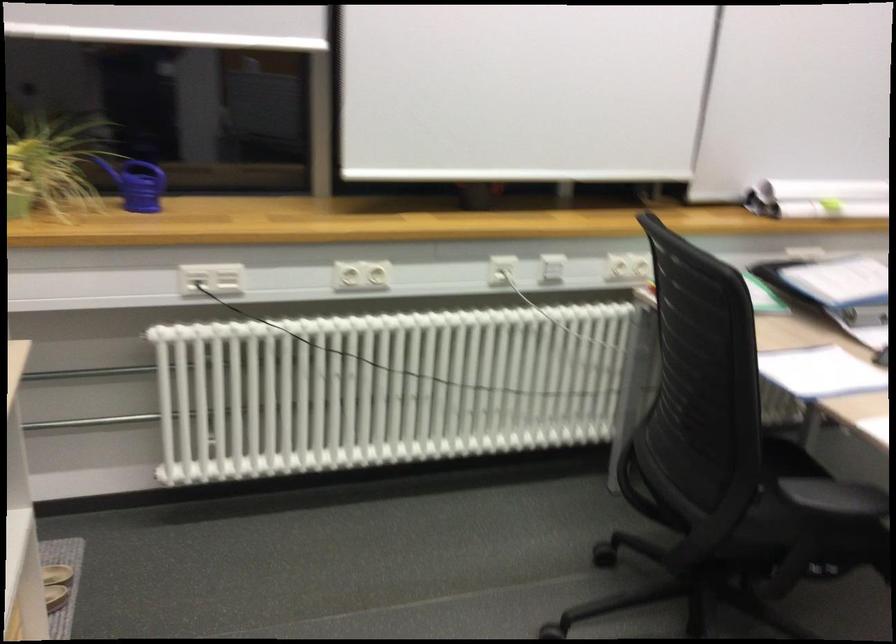
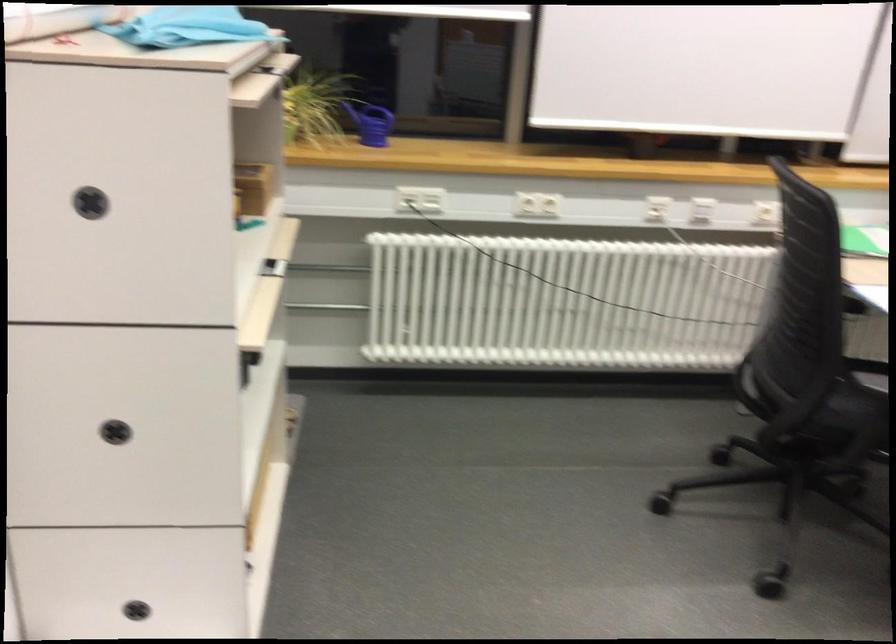
Find the pixel in the second image that matches pixel 500 275 in the first image.

(657, 209)